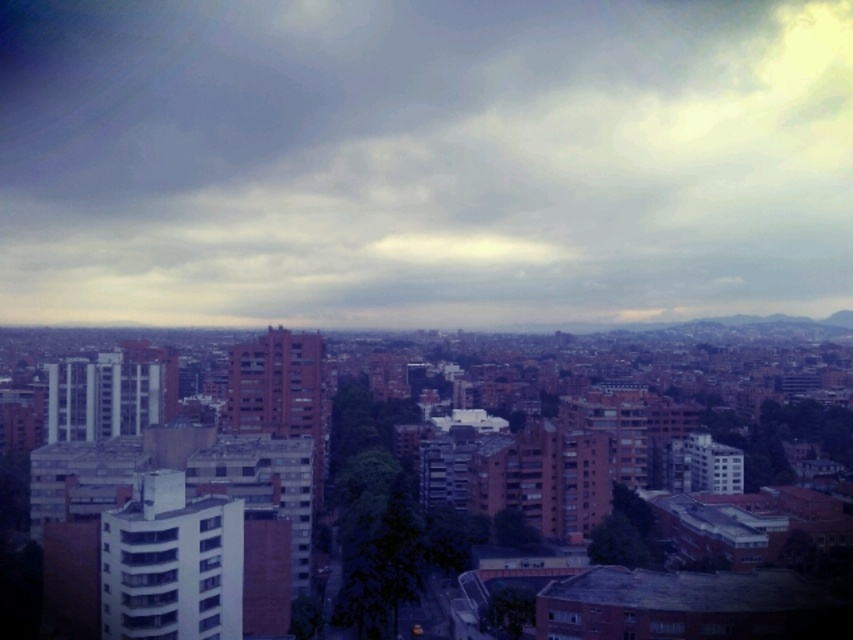
Question: Among these points, which one is nearest to the camera?

Choices:
 (A) (230, 113)
 (B) (692, 499)

Answer: (B)

Question: Does cloudy sky at upper center lie behind matte brick building at center?

Choices:
 (A) no
 (B) yes

Answer: (B)

Question: Which object is closer to the camera taking this photo?

Choices:
 (A) matte brick building at center
 (B) cloudy sky at upper center

Answer: (A)

Question: Which of the following is the closest to the observer?

Choices:
 (A) matte brick building at center
 (B) cloudy sky at upper center

Answer: (A)

Question: Observing the image, what is the correct spatial positioning of cloudy sky at upper center in reference to matte brick building at center?

Choices:
 (A) above
 (B) below

Answer: (A)

Question: Where is cloudy sky at upper center located in relation to matte brick building at center in the image?

Choices:
 (A) below
 (B) above

Answer: (B)